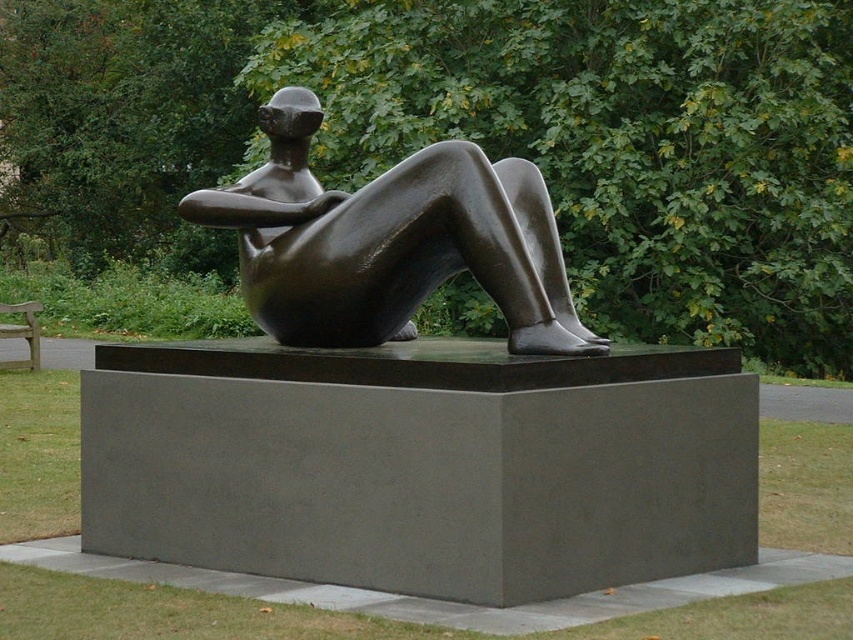
Is bronze sculpture at center positioned in front of wooden park bench at left?

Yes, it is in front of wooden park bench at left.

Looking at this image, which is below, bronze sculpture at center or wooden park bench at left?

wooden park bench at left is below.

Who is more distant from viewer, (540, 305) or (16, 305)?

Point (16, 305)

Image resolution: width=853 pixels, height=640 pixels. In order to click on bronze sculpture at center in this screenshot , I will do `click(390, 241)`.